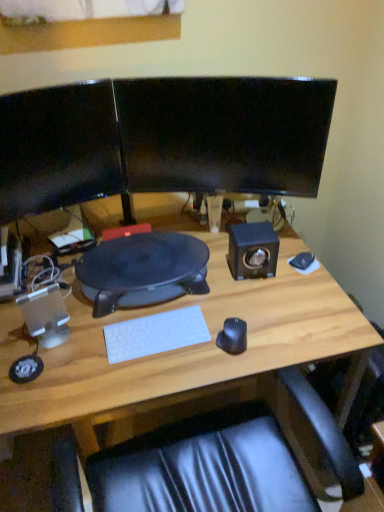
The width and height of the screenshot is (384, 512). Find the location of `empty space that is in between matte black speaker at right, placed as the 1th speaker when sorted from right to left, and white matte mousepad at right`. empty space that is in between matte black speaker at right, placed as the 1th speaker when sorted from right to left, and white matte mousepad at right is located at coordinates (284, 266).